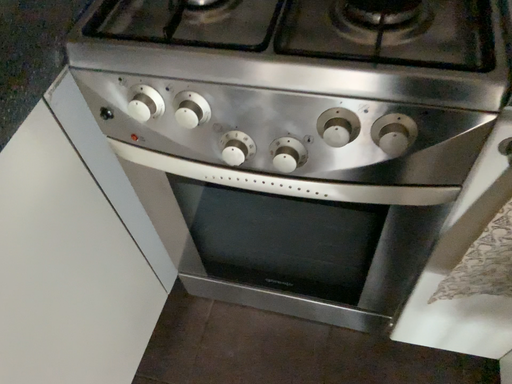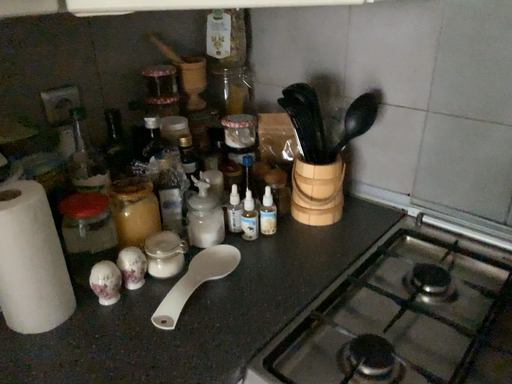
Question: Which way did the camera rotate in the video?

Choices:
 (A) rotated left
 (B) rotated right

Answer: (A)